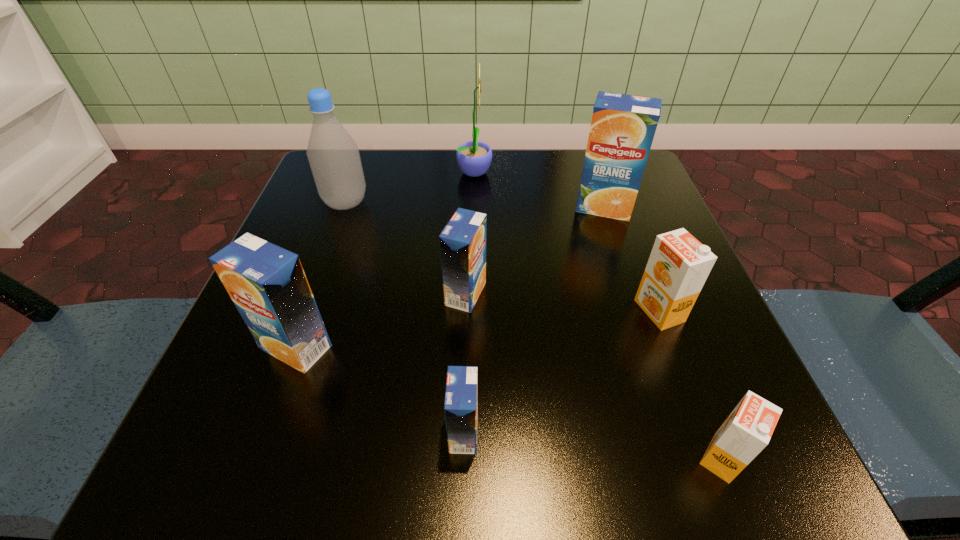
In the image, there is a desktop. Find the location of `vacant space at the near left corner`. vacant space at the near left corner is located at coordinates (209, 422).

Identify the location of vacant area that lies between the fifth shortest object and the bigger orange orange juice. (478, 329).

I want to click on empty space between the gray bottle and the farther orange orange juice, so click(x=502, y=257).

This screenshot has width=960, height=540. I want to click on free space between the rightmost blue orange_juice and the farther orange orange juice, so click(632, 259).

Locate an element on the screen. free space that is in between the farther orange orange juice and the farthest object is located at coordinates (566, 241).

You are a GUI agent. You are given a task and a screenshot of the screen. Output one action in this format:
    pyautogui.click(x=<x>, y=<y>)
    Task: Click on the vacant space in between the rightmost blue orange_juice and the smallest blue orange_juice
    The width and height of the screenshot is (960, 540).
    Given the screenshot: What is the action you would take?
    coord(534,320)

Locate an element on the screen. This screenshot has height=540, width=960. empty location between the farthest object and the gray bottle is located at coordinates [x=410, y=187].

Where is `empty space that is in between the smallest blue orange_juice and the bottle`? empty space that is in between the smallest blue orange_juice and the bottle is located at coordinates (405, 318).

Locate an element on the screen. The height and width of the screenshot is (540, 960). free space between the farthest object and the second nearest blue orange_juice is located at coordinates (385, 259).

Where is `free space between the second smallest blue orange_juice and the nearer orange orange juice`? free space between the second smallest blue orange_juice and the nearer orange orange juice is located at coordinates pyautogui.click(x=594, y=376).